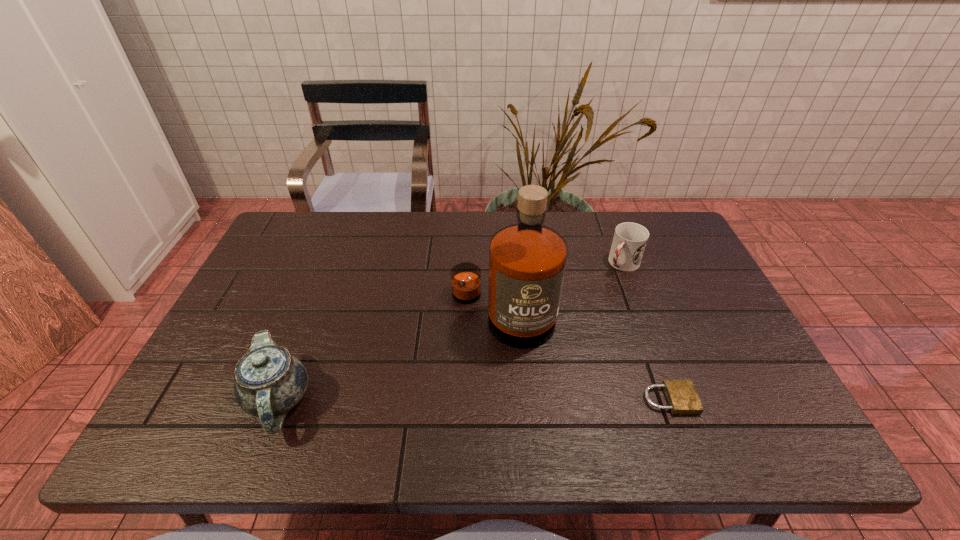
You are a GUI agent. You are given a task and a screenshot of the screen. Output one action in this format:
    pyautogui.click(x=<x>, y=<y>)
    Task: Click on the vacant space at the near edge of the desktop
    The image size is (960, 540).
    Given the screenshot: What is the action you would take?
    pyautogui.click(x=551, y=380)

Where is `free space at the left edge`? free space at the left edge is located at coordinates (237, 302).

Locate an element on the screen. free spot at the right edge of the desktop is located at coordinates (680, 340).

The height and width of the screenshot is (540, 960). Identify the location of free space at the near left corner of the desktop. (223, 406).

Identify the location of vacant space at the far right corner of the desktop. (662, 235).

Find the location of a particular element. The image size is (960, 540). free space between the farthest object and the padlock is located at coordinates (646, 332).

Locate an element on the screen. The width and height of the screenshot is (960, 540). unoccupied position between the second tallest object and the tallest object is located at coordinates (390, 357).

Find the location of `free spot between the tallest object and the third shortest object`. free spot between the tallest object and the third shortest object is located at coordinates (390, 357).

You are a GUI agent. You are given a task and a screenshot of the screen. Output one action in this format:
    pyautogui.click(x=<x>, y=<y>)
    Task: Click on the empty space that is in between the shortest object and the chinaware
    
    Given the screenshot: What is the action you would take?
    pyautogui.click(x=473, y=400)

Identify the location of unoccupied position between the third tallest object and the third shortest object. This screenshot has width=960, height=540. (450, 332).